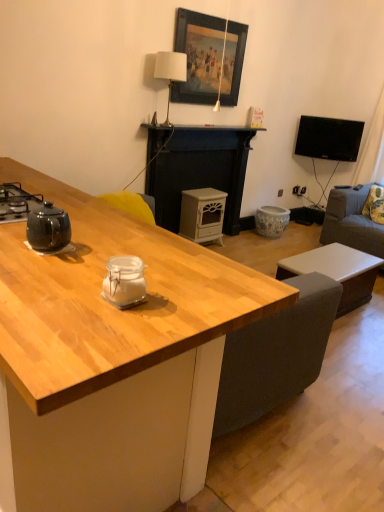
Question: Visually, is gray fabric couch at right positioned to the left or to the right of wooden framed painting at upper center?

Choices:
 (A) left
 (B) right

Answer: (B)

Question: From a real-world perspective, is gray fabric couch at right physically located above or below wooden framed painting at upper center?

Choices:
 (A) below
 (B) above

Answer: (A)

Question: Considering the real-world distances, which object is farthest from the white matte fireplace at center?

Choices:
 (A) wooden framed painting at upper center
 (B) gray fabric couch at right
 (C) clear glass jar at center, which appears as the first appliance when ordered from the bottom
 (D) white matte rectangular table at lower right
 (E) white matte wood stove at center, which appears as the 2th appliance when ordered from the bottom

Answer: (C)

Question: Based on their relative distances, which object is farther from the clear glass jar at center, positioned as the second appliance in back-to-front order?

Choices:
 (A) wooden desk at center
 (B) wooden framed painting at upper center
 (C) white matte rectangular table at lower right
 (D) white fabric lampshade at upper center
 (E) white matte fireplace at center

Answer: (E)